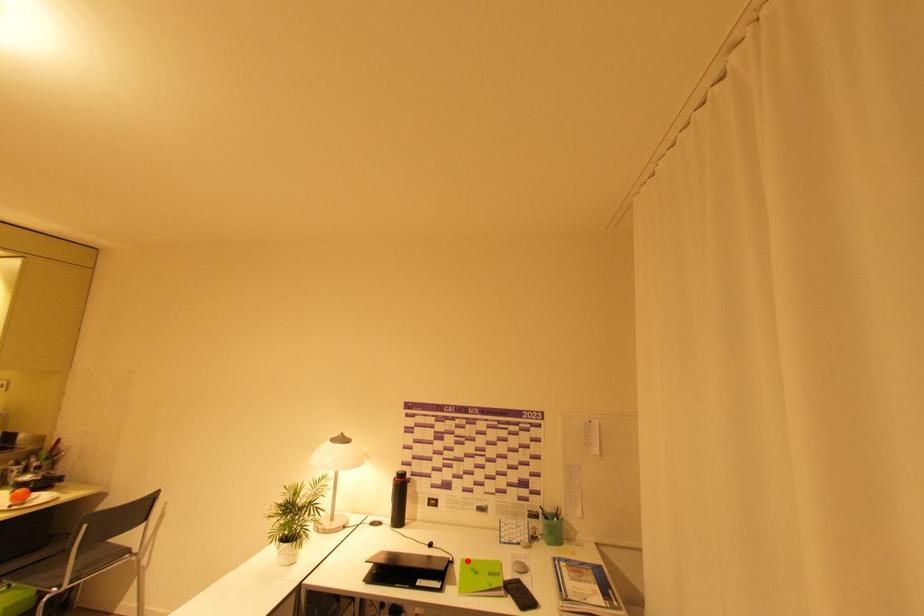
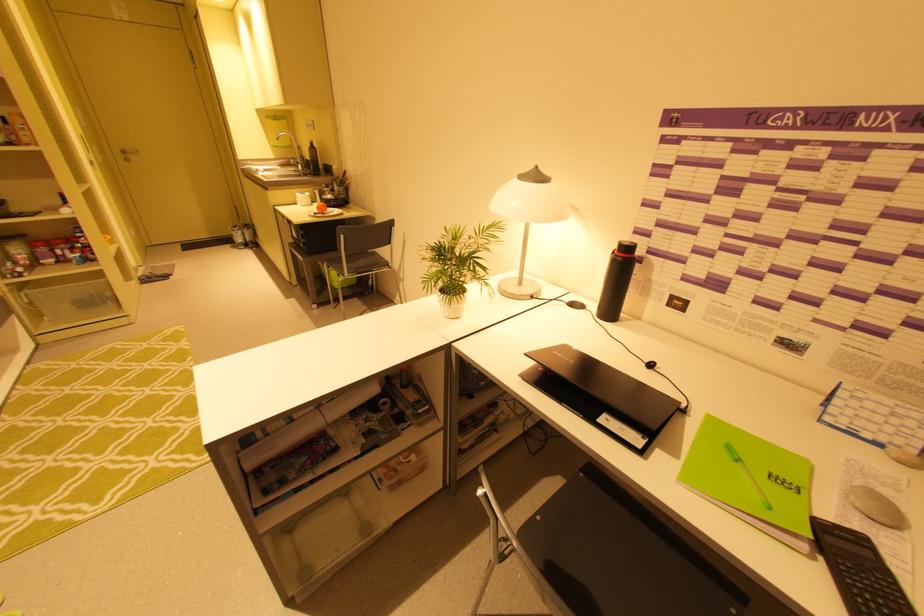
Find the pixel in the second image that matches the highlighted location in the first image.

(714, 419)